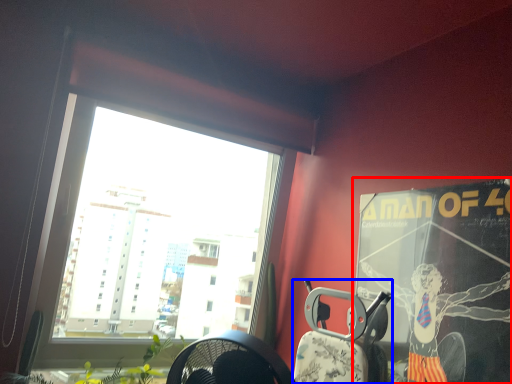
Question: Which point is further to the camera, poster page (highlighted by a red box) or armchair (highlighted by a blue box)?

Choices:
 (A) poster page
 (B) armchair

Answer: (B)